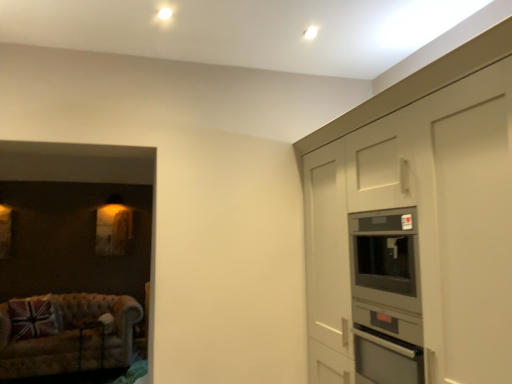
Question: Is point (38, 306) closer or farther from the camera than point (96, 322)?

Choices:
 (A) farther
 (B) closer

Answer: (B)

Question: In terms of width, does union jack fabric pillow at lower left look wider or thinner when compared to metallic silver table at lower left?

Choices:
 (A) thin
 (B) wide

Answer: (B)

Question: Based on their relative distances, which object is nearer to the matte gray cabinetry at right?

Choices:
 (A) metallic silver table at lower left
 (B) union jack fabric pillow at lower left
 (C) velvet beige couch at lower left

Answer: (C)

Question: Which is farther from the metallic silver table at lower left?

Choices:
 (A) union jack fabric pillow at lower left
 (B) velvet beige couch at lower left
 (C) matte gray cabinetry at right

Answer: (C)